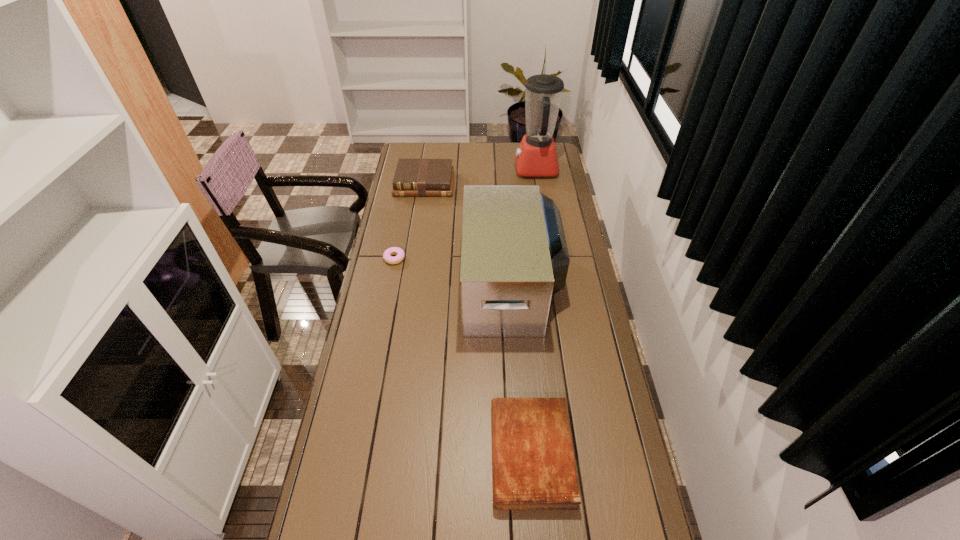
Find the location of a particular element. The height and width of the screenshot is (540, 960). free location located on the front-facing side of the fourth shortest object is located at coordinates [x=393, y=285].

At what (x,y) coordinates should I click in order to perform the action: click on vacant position located 0.120m on the front-facing side of the fourth shortest object. Please return your answer as a coordinate pair (x, y). Looking at the image, I should click on (434, 285).

Image resolution: width=960 pixels, height=540 pixels. I want to click on blank area located 0.350m on the front-facing side of the fourth shortest object, so click(x=374, y=285).

What are the coordinates of `vacant space located 0.350m on the spine side of the third shortest object` in the screenshot? It's located at (415, 247).

Identify the location of free space located on the spine side of the fourth tallest object. Image resolution: width=960 pixels, height=540 pixels. (412, 454).

The image size is (960, 540). What are the coordinates of `free space located 0.280m on the spine side of the fourth tallest object` in the screenshot? It's located at (395, 454).

You are a GUI agent. You are given a task and a screenshot of the screen. Output one action in this format:
    pyautogui.click(x=<x>, y=<y>)
    Task: Click on the free location located on the spine side of the fourth tallest object
    This screenshot has width=960, height=540.
    Given the screenshot: What is the action you would take?
    pyautogui.click(x=457, y=454)

Locate an element on the screen. free spot located 0.340m on the front of the doughnut is located at coordinates [380, 333].

You are a GUI agent. You are given a task and a screenshot of the screen. Output one action in this format:
    pyautogui.click(x=<x>, y=<y>)
    Task: Click on the object positioned at the far edge
    This screenshot has width=960, height=540.
    Given the screenshot: What is the action you would take?
    pyautogui.click(x=536, y=156)

The width and height of the screenshot is (960, 540). I want to click on Bible that is positioned at the left edge, so (423, 177).